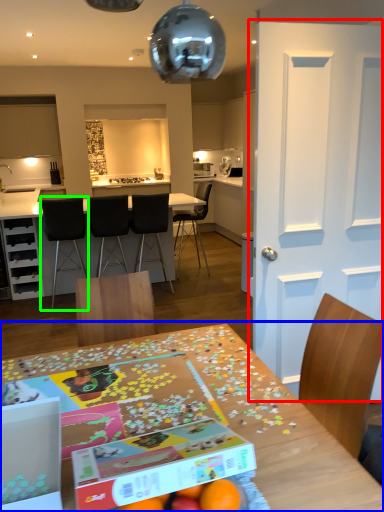
Question: Which is nearer to the door (highlighted by a red box)? table (highlighted by a blue box) or chair (highlighted by a green box).

Choices:
 (A) table
 (B) chair

Answer: (A)